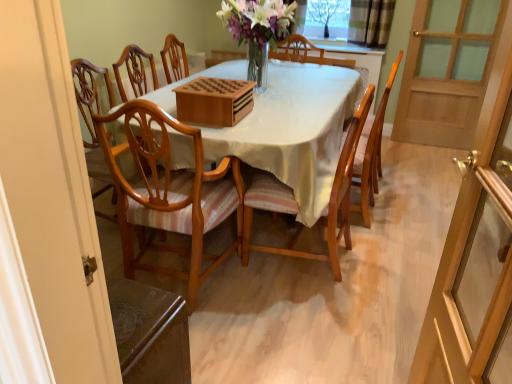
Describe the element at coordinates (475, 268) in the screenshot. The height and width of the screenshot is (384, 512). I see `transparent glass screen door at right, the second screen door in the right-to-left sequence` at that location.

What is the approximate height of clear glass window at upper center?

It is 16.09 inches.

Describe the element at coordinates (346, 21) in the screenshot. This screenshot has width=512, height=384. I see `clear glass window at upper center` at that location.

Image resolution: width=512 pixels, height=384 pixels. I want to click on transparent glass tree at upper center, so click(x=327, y=19).

The image size is (512, 384). In order to click on wooden screen door at right, marked as the 2th screen door in a front-to-back arrangement in this screenshot , I will do `click(450, 70)`.

The image size is (512, 384). Describe the element at coordinates (371, 152) in the screenshot. I see `wooden chair at center, placed as the 1th chair when sorted from right to left` at that location.

Measure the distance between wooden chair at center, placed as the 1th chair when sorted from right to left, and camera.

wooden chair at center, placed as the 1th chair when sorted from right to left, and camera are 7.44 feet apart from each other.

Where is `transparent glass screen door at right, which is counted as the second screen door, starting from the top`? transparent glass screen door at right, which is counted as the second screen door, starting from the top is located at coordinates (475, 268).

Between wooden chair with striped cushion at center, the 2th chair viewed from the left, and clear glass window at upper center, which one has smaller width?

Thinner between the two is clear glass window at upper center.

Is wooden chair with striped cushion at center, the second chair viewed from the right, next to clear glass window at upper center?

wooden chair with striped cushion at center, the second chair viewed from the right, and clear glass window at upper center are not in contact.

Is wooden chair with striped cushion at center, the second chair viewed from the right, oriented towards clear glass window at upper center?

No, wooden chair with striped cushion at center, the second chair viewed from the right, is not aimed at clear glass window at upper center.

From the image's perspective, is wooden chair with striped cushion at center, the 2th chair viewed from the left, beneath clear glass window at upper center?

Correct, wooden chair with striped cushion at center, the 2th chair viewed from the left, appears lower than clear glass window at upper center in the image.

Between wooden chair with striped cushion at center, the 2th chair viewed from the left, and light brown wood chair at center, which is counted as the 3th chair, starting from the right, which one has more height?

light brown wood chair at center, which is counted as the 3th chair, starting from the right.

Who is bigger, wooden chair with striped cushion at center, the second chair viewed from the right, or light brown wood chair at center, arranged as the first chair when viewed from the left?

With larger size is light brown wood chair at center, arranged as the first chair when viewed from the left.

The image size is (512, 384). I want to click on chair located on the left of wooden chair with striped cushion at center, the second chair viewed from the right, so 170,192.

Does wooden chair with striped cushion at center, the second chair viewed from the right, appear on the right side of light brown wood chair at center, which is counted as the 3th chair, starting from the right?

Indeed, wooden chair with striped cushion at center, the second chair viewed from the right, is positioned on the right side of light brown wood chair at center, which is counted as the 3th chair, starting from the right.

Is wooden chair at center, which appears as the 3th chair when viewed from the left, outside of wooden table at center?

No, wooden chair at center, which appears as the 3th chair when viewed from the left, is inside or overlapping with wooden table at center.

From a real-world perspective, relative to wooden table at center, is wooden chair at center, placed as the 1th chair when sorted from right to left, vertically above or below?

wooden chair at center, placed as the 1th chair when sorted from right to left, is situated higher than wooden table at center in the real world.

Between wooden chair at center, placed as the 1th chair when sorted from right to left, and wooden table at center, which one appears on the right side from the viewer's perspective?

Positioned to the right is wooden chair at center, placed as the 1th chair when sorted from right to left.

Who is more distant, translucent glass vase at center or wooden table at center?

translucent glass vase at center is more distant.

Is translucent glass vase at center directly adjacent to wooden table at center?

translucent glass vase at center and wooden table at center are not in contact.

Where is `kitchen & dining room table located underneath the translucent glass vase at center (from a real-world perspective)`? The image size is (512, 384). kitchen & dining room table located underneath the translucent glass vase at center (from a real-world perspective) is located at coordinates (284, 142).

In the scene shown: Can you confirm if translucent glass vase at center is smaller than wooden table at center?

Correct, translucent glass vase at center occupies less space than wooden table at center.

Is light brown wood chair at center, arranged as the first chair when viewed from the left, at the right side of translucent glass vase at center?

No, light brown wood chair at center, arranged as the first chair when viewed from the left, is not to the right of translucent glass vase at center.

Are light brown wood chair at center, which is counted as the 3th chair, starting from the right, and translucent glass vase at center located far from each other?

Yes, light brown wood chair at center, which is counted as the 3th chair, starting from the right, is far from translucent glass vase at center.

Which of these two, light brown wood chair at center, which is counted as the 3th chair, starting from the right, or translucent glass vase at center, stands shorter?

Standing shorter between the two is translucent glass vase at center.

From a real-world perspective, which is physically below, light brown wood chair at center, arranged as the first chair when viewed from the left, or translucent glass vase at center?

light brown wood chair at center, arranged as the first chair when viewed from the left, from a real-world perspective.

Are clear glass window at upper center and wooden screen door at right, marked as the 2th screen door in a front-to-back arrangement, beside each other?

clear glass window at upper center is not next to wooden screen door at right, marked as the 2th screen door in a front-to-back arrangement, and they're not touching.

Can you confirm if clear glass window at upper center is thinner than wooden screen door at right, which ranks as the first screen door in back-to-front order?

Incorrect, the width of clear glass window at upper center is not less than that of wooden screen door at right, which ranks as the first screen door in back-to-front order.

Looking at the image, does clear glass window at upper center seem bigger or smaller compared to wooden screen door at right, which ranks as the first screen door in back-to-front order?

Clearly, clear glass window at upper center is smaller in size than wooden screen door at right, which ranks as the first screen door in back-to-front order.

Consider the image. How far apart are clear glass window at upper center and wooden screen door at right, the second screen door when ordered from bottom to top?

25.22 inches.

How much distance is there between light brown wood chair at center, arranged as the first chair when viewed from the left, and transparent glass screen door at right, arranged as the 1th screen door when viewed from the left?

The distance of light brown wood chair at center, arranged as the first chair when viewed from the left, from transparent glass screen door at right, arranged as the 1th screen door when viewed from the left, is 3.78 feet.

From their relative heights in the image, would you say light brown wood chair at center, arranged as the first chair when viewed from the left, is taller or shorter than transparent glass screen door at right, the second screen door in the right-to-left sequence?

light brown wood chair at center, arranged as the first chair when viewed from the left, is shorter than transparent glass screen door at right, the second screen door in the right-to-left sequence.

Can we say light brown wood chair at center, which is counted as the 3th chair, starting from the right, lies outside transparent glass screen door at right, the second screen door in the right-to-left sequence?

Yes.

This screenshot has width=512, height=384. Identify the location of the 2nd chair in front of the clear glass window at upper center. (297, 205).

Identify the location of the 1st chair above the light brown wood chair at center, which is counted as the 3th chair, starting from the right (from the image's perspective). The image size is (512, 384). (297, 205).

Which object lies further to the anchor point wooden table at center, wooden screen door at right, the first screen door from the top, or clear glass window at upper center?

wooden screen door at right, the first screen door from the top.

Estimate the real-world distances between objects in this image. Which object is closer to transparent glass tree at upper center, translucent glass vase at center or light brown wood chair at center, arranged as the first chair when viewed from the left?

translucent glass vase at center lies closer to transparent glass tree at upper center than the other object.

When comparing their distances from light brown wood chair at center, arranged as the first chair when viewed from the left, does transparent glass screen door at right, arranged as the 1th screen door when viewed from the left, or wooden table at center seem further?

transparent glass screen door at right, arranged as the 1th screen door when viewed from the left, is positioned further to the anchor light brown wood chair at center, arranged as the first chair when viewed from the left.

Considering their positions, is wooden chair at center, placed as the 1th chair when sorted from right to left, positioned further to wooden screen door at right, which ranks as the first screen door in back-to-front order, than light brown wood chair at center, arranged as the first chair when viewed from the left?

light brown wood chair at center, arranged as the first chair when viewed from the left.

Estimate the real-world distances between objects in this image. Which object is further from wooden screen door at right, the first screen door from the top, translucent glass vase at center or wooden table at center?

Based on the image, wooden table at center appears to be further to wooden screen door at right, the first screen door from the top.

When comparing their distances from light brown wood chair at center, arranged as the first chair when viewed from the left, does transparent glass tree at upper center or wooden chair with striped cushion at center, the 2th chair viewed from the left, seem closer?

Based on the image, wooden chair with striped cushion at center, the 2th chair viewed from the left, appears to be nearer to light brown wood chair at center, arranged as the first chair when viewed from the left.

Based on their spatial positions, is translucent glass vase at center or wooden chair at center, which appears as the 3th chair when viewed from the left, closer to wooden screen door at right, the second screen door when ordered from bottom to top?

Among the two, wooden chair at center, which appears as the 3th chair when viewed from the left, is located nearer to wooden screen door at right, the second screen door when ordered from bottom to top.

Based on their spatial positions, is wooden table at center or wooden chair at center, which appears as the 3th chair when viewed from the left, further from light brown wood chair at center, arranged as the first chair when viewed from the left?

wooden chair at center, which appears as the 3th chair when viewed from the left, is positioned further to the anchor light brown wood chair at center, arranged as the first chair when viewed from the left.

The image size is (512, 384). Identify the location of screen door between wooden chair at center, placed as the 1th chair when sorted from right to left, and transparent glass tree at upper center in the front-back direction. (450, 70).

Where is `kitchen & dining room table that lies between translucent glass vase at center and wooden chair with striped cushion at center, the second chair viewed from the right, from top to bottom`? Image resolution: width=512 pixels, height=384 pixels. kitchen & dining room table that lies between translucent glass vase at center and wooden chair with striped cushion at center, the second chair viewed from the right, from top to bottom is located at coordinates (284, 142).

Image resolution: width=512 pixels, height=384 pixels. Find the location of `floral arrangement between transparent glass screen door at right, which is counted as the second screen door, starting from the top, and transparent glass tree at upper center, along the z-axis`. floral arrangement between transparent glass screen door at right, which is counted as the second screen door, starting from the top, and transparent glass tree at upper center, along the z-axis is located at coordinates (257, 30).

Locate an element on the screen. screen door positioned between light brown wood chair at center, arranged as the first chair when viewed from the left, and transparent glass tree at upper center from near to far is located at coordinates (450, 70).